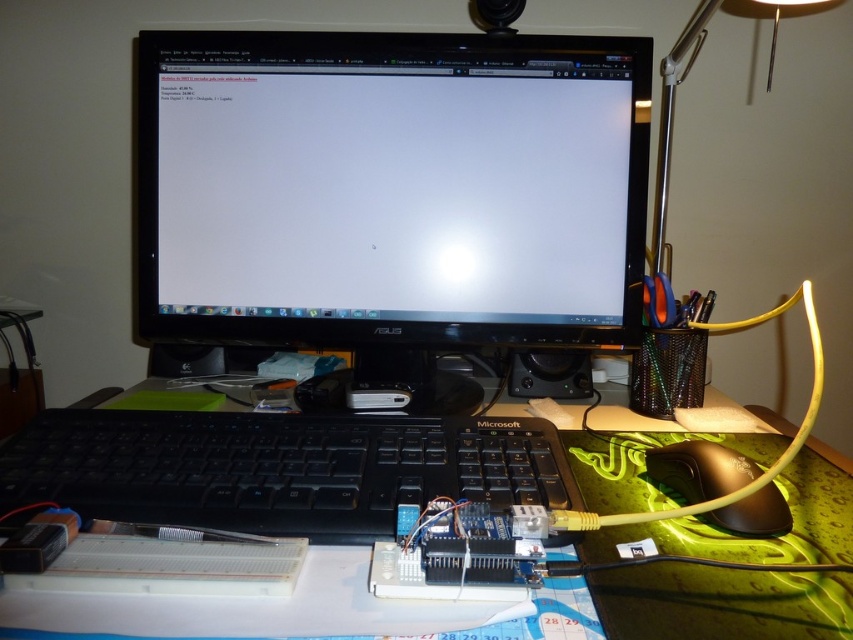
In order to click on green rubber mousepad at center in this screenshot , I will do `click(259, 609)`.

Is green rubber mousepad at center below black plastic keyboard at center?

Yes.

You are a GUI agent. You are given a task and a screenshot of the screen. Output one action in this format:
    pyautogui.click(x=<x>, y=<y>)
    Task: Click on the green rubber mousepad at center
    
    Given the screenshot: What is the action you would take?
    pyautogui.click(x=259, y=609)

Does black glossy monitor at center lie behind metallic silver lamp at upper right?

No, it is in front of metallic silver lamp at upper right.

Locate an element on the screen. The image size is (853, 640). black glossy monitor at center is located at coordinates (390, 188).

Does black glossy monitor at center have a greater height compared to black plastic mouse at lower right?

Yes, black glossy monitor at center is taller than black plastic mouse at lower right.

Where is `black glossy monitor at center`? The width and height of the screenshot is (853, 640). black glossy monitor at center is located at coordinates (390, 188).

I want to click on black glossy monitor at center, so click(x=390, y=188).